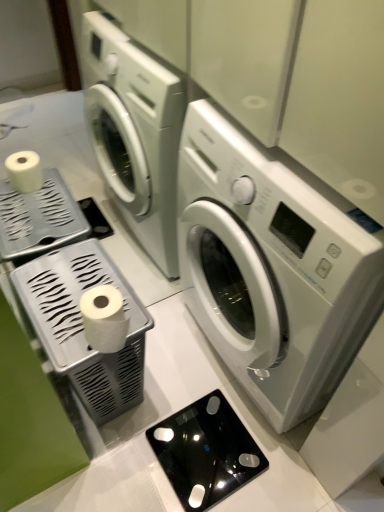
Find the location of a particular element. free space in front of white glossy washing machine at center is located at coordinates (239, 471).